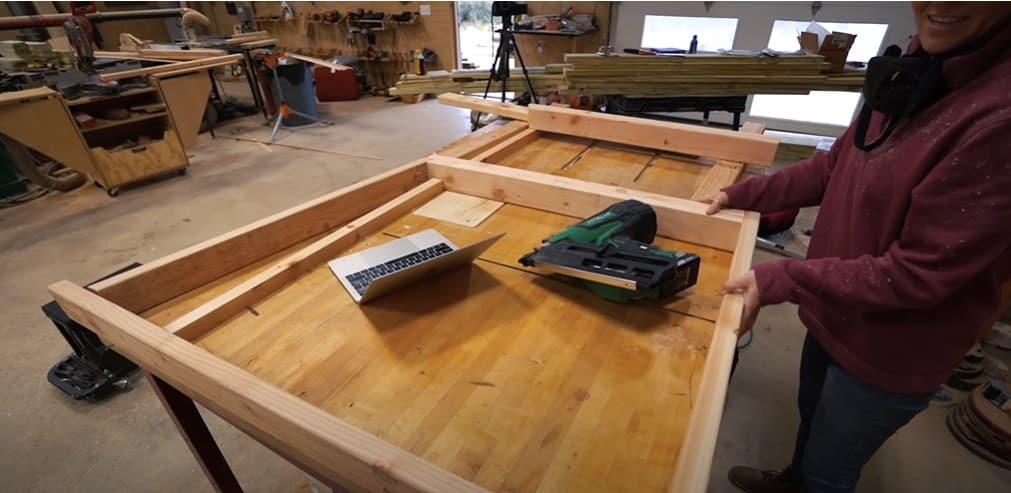
This screenshot has height=493, width=1011. I want to click on work station, so click(504, 363).